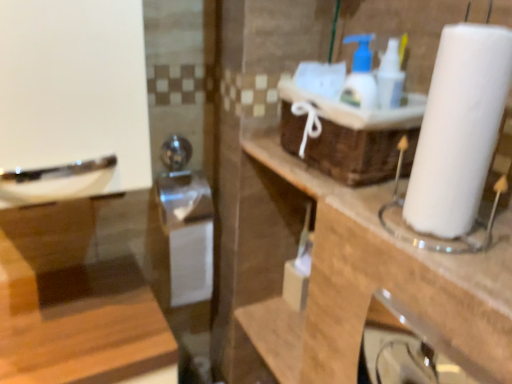
What do you see at coordinates (375, 283) in the screenshot? The image size is (512, 384). I see `white paper towel at right` at bounding box center [375, 283].

Locate an element on the screen. The width and height of the screenshot is (512, 384). brown woven basket at upper center is located at coordinates (351, 136).

Identify the location of white paper towel at right. The height and width of the screenshot is (384, 512). pos(375,283).

How much distance is there between white paper towel at right and white paper at right?

white paper towel at right is 7.96 inches from white paper at right.

Is there a large distance between white paper towel at right and white paper at right?

white paper towel at right is near white paper at right, not far away.

Consider the image. Is white paper at right at the back of white paper towel at right?

white paper towel at right does not have its back to white paper at right.

Is point (355, 330) closer to viewer compared to point (441, 81)?

That is False.

Considering their positions, is white paper at right located in front of or behind white paper towel at right?

white paper at right is positioned closer to the viewer than white paper towel at right.

Is there a large distance between white paper at right and white paper towel at right?

No, white paper at right is in close proximity to white paper towel at right.

Which is correct: white paper at right is inside white paper towel at right, or outside of it?

white paper at right lies outside white paper towel at right.

Is white paper at right facing away from white paper towel at right?

No, white paper at right's orientation is not away from white paper towel at right.

Is white paper towel at right not inside brown woven basket at upper center?

Yes, white paper towel at right is located beyond the bounds of brown woven basket at upper center.

Identify the location of counter top on the right of the brown woven basket at upper center. This screenshot has height=384, width=512. (375, 283).

Is white paper towel at right in front of or behind brown woven basket at upper center in the image?

Clearly, white paper towel at right is in front of brown woven basket at upper center.

Does brown woven basket at upper center turn towards white paper at right?

No.

Is brown woven basket at upper center located outside white paper at right?

Absolutely, brown woven basket at upper center is external to white paper at right.

Who is shorter, brown woven basket at upper center or white paper at right?

With less height is brown woven basket at upper center.

From the picture: From a real-world perspective, which object stands above the other?

In real-world perspective, white paper at right is above.

Is white paper at right oriented towards brown woven basket at upper center?

No, white paper at right is not aimed at brown woven basket at upper center.

In the image, is white paper at right positioned in front of or behind brown woven basket at upper center?

Visually, white paper at right is located in front of brown woven basket at upper center.

Which object is positioned more to the right, white paper at right or brown woven basket at upper center?

white paper at right is more to the right.

Is white paper at right spatially inside brown woven basket at upper center, or outside of it?

white paper at right cannot be found inside brown woven basket at upper center.

Considering the relative positions of brown woven basket at upper center and white paper towel at right in the image provided, is brown woven basket at upper center to the left of white paper towel at right from the viewer's perspective?

Indeed, brown woven basket at upper center is positioned on the left side of white paper towel at right.

Does point (347, 129) appear closer or farther from the camera than point (367, 287)?

Point (347, 129) appears to be farther away from the viewer than point (367, 287).

From a real-world perspective, which object rests below the other?

From a 3D spatial view, white paper towel at right is below.

The image size is (512, 384). I want to click on counter top below the white paper at right (from a real-world perspective), so click(x=375, y=283).

Where is `counter top on the left of white paper at right`? Image resolution: width=512 pixels, height=384 pixels. counter top on the left of white paper at right is located at coordinates (375, 283).

When comparing their distances from brown woven basket at upper center, does white paper towel at right or white paper at right seem closer?

white paper towel at right lies closer to brown woven basket at upper center than the other object.

Estimate the real-world distances between objects in this image. Which object is further from white paper at right, white paper towel at right or brown woven basket at upper center?

white paper towel at right.

Estimate the real-world distances between objects in this image. Which object is further from brown woven basket at upper center, white paper at right or white paper towel at right?

Among the two, white paper at right is located further to brown woven basket at upper center.

Which object lies further to the anchor point white paper towel at right, white paper at right or brown woven basket at upper center?

Based on the image, white paper at right appears to be further to white paper towel at right.

When comparing their distances from white paper towel at right, does brown woven basket at upper center or white paper at right seem further?

white paper at right is further to white paper towel at right.

Which object lies nearer to the anchor point white paper at right, brown woven basket at upper center or white paper towel at right?

Among the two, brown woven basket at upper center is located nearer to white paper at right.

You are a GUI agent. You are given a task and a screenshot of the screen. Output one action in this format:
    pyautogui.click(x=<x>, y=<y>)
    Task: Click on the counter top between white paper at right and brown woven basket at upper center in the front-back direction
    
    Given the screenshot: What is the action you would take?
    pyautogui.click(x=375, y=283)